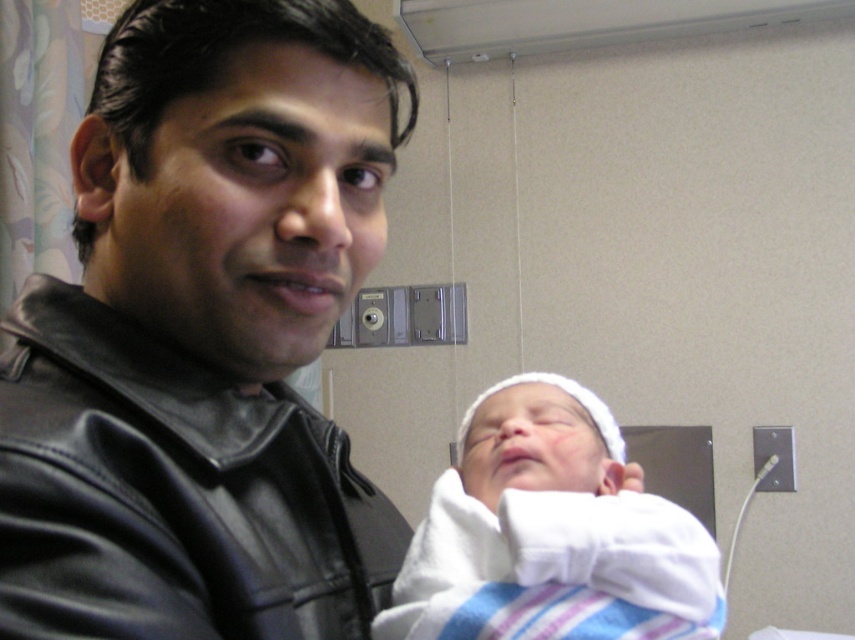
Does black leather jacket at left lie in front of white soft cloth at center?

Yes, black leather jacket at left is closer to the viewer.

Identify the location of black leather jacket at left. This screenshot has height=640, width=855. (172, 493).